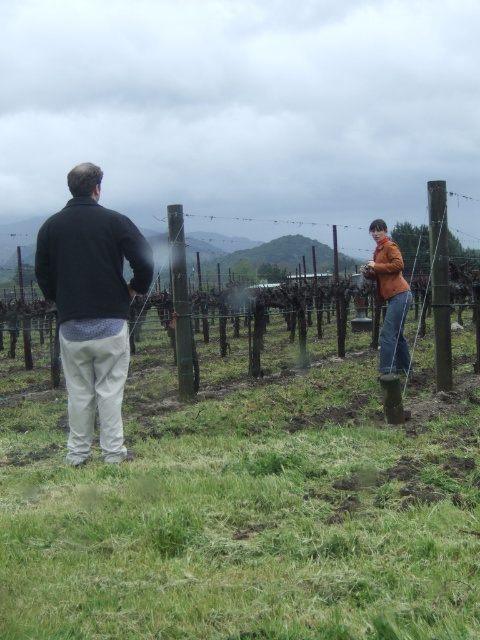
In the scene shown: Can you confirm if orange leather jacket at right is positioned to the left of brown wooden post at right?

Yes, orange leather jacket at right is to the left of brown wooden post at right.

Does point (385, 310) lie behind point (436, 268)?

Yes, it is behind point (436, 268).

Does point (385, 252) lie behind point (432, 305)?

Yes, it is behind point (432, 305).

Identify the location of orange leather jacket at right. This screenshot has height=640, width=480. (389, 298).

Is orange leather jacket at right bigger than smooth wooden post at center?

Incorrect, orange leather jacket at right is not larger than smooth wooden post at center.

Who is more distant from viewer, (402, 301) or (176, 300)?

The point (402, 301) is more distant.

Is point (397, 316) positioned before point (177, 257)?

No, (397, 316) is further to viewer.

Locate an element on the screen. This screenshot has height=640, width=480. orange leather jacket at right is located at coordinates (389, 298).

Is dark gray sweater at left positioned in front of orange leather jacket at right?

Yes, it is in front of orange leather jacket at right.

Who is taller, dark gray sweater at left or orange leather jacket at right?

dark gray sweater at left

At what (x,y) coordinates should I click in order to perform the action: click on dark gray sweater at left. Please return your answer as a coordinate pair (x, y). This screenshot has width=480, height=640. Looking at the image, I should click on (92, 307).